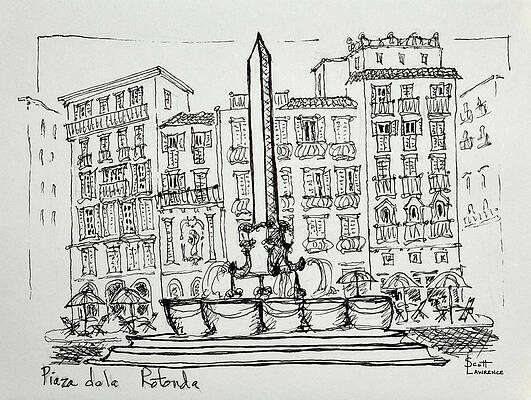
The width and height of the screenshot is (531, 400). Identify the location of arched windows. (90, 286), (114, 287), (143, 286), (179, 288), (193, 288).